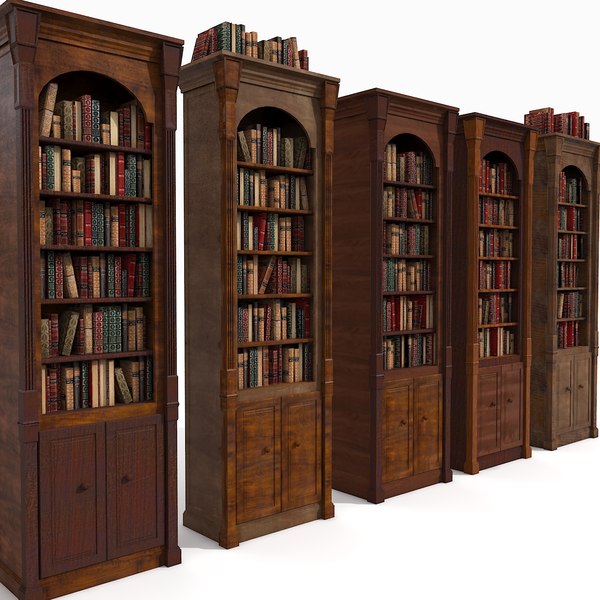
Where is `cabinet door`? The width and height of the screenshot is (600, 600). cabinet door is located at coordinates (62, 509), (126, 509), (254, 468), (300, 467), (394, 439), (421, 439), (490, 430), (513, 428), (563, 402), (577, 402).